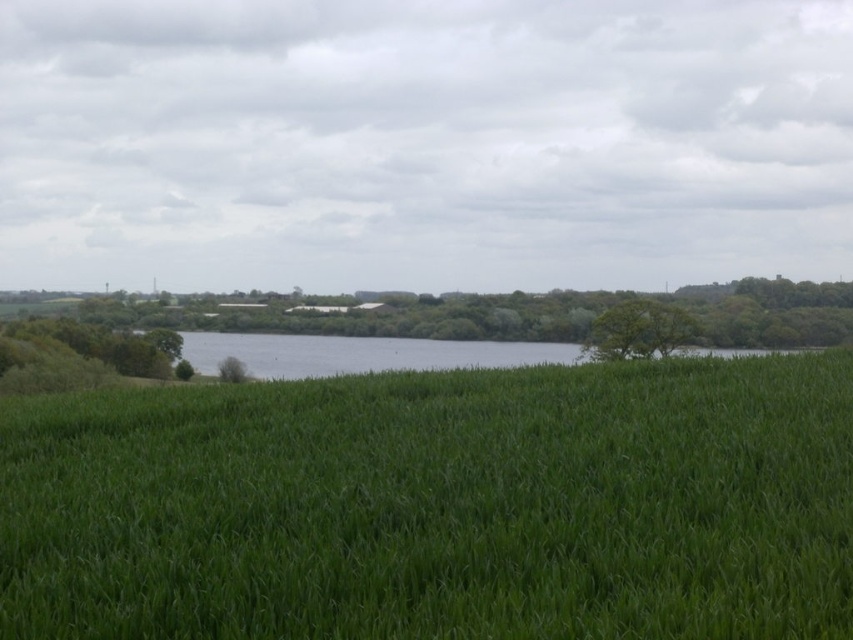
You are standing at the origin point of the image. Where is the green grassy field at center located relative to you?

The green grassy field at center is located at point (438, 506) relative to the origin point.

You are standing in the field of vibrant green crops and want to walk to the green leafy tree at right. Which direction should you head towards from the clear water at center?

The clear water at center is positioned on the left side of green leafy tree at right. Therefore, to reach the green leafy tree at right from the clear water at center, you should head towards the right direction.